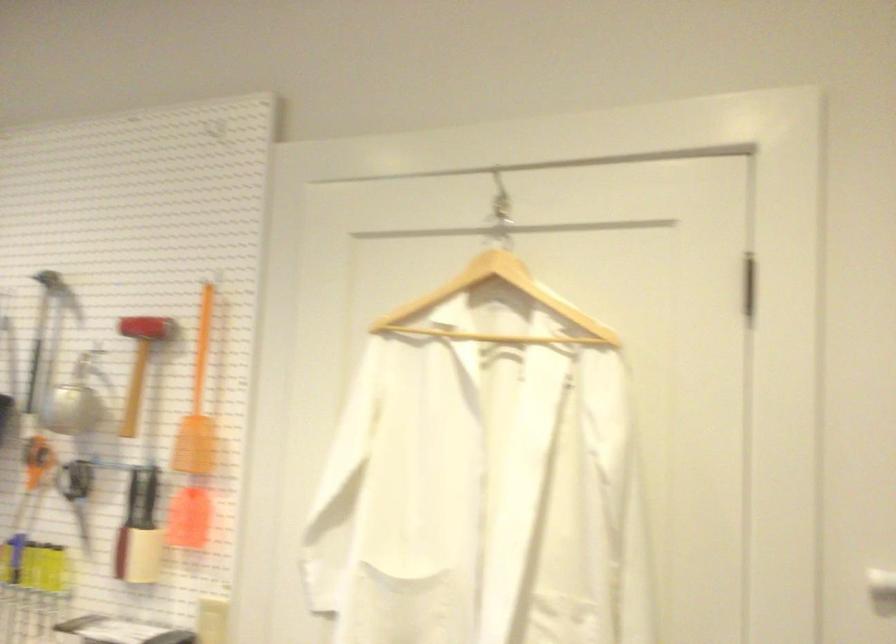
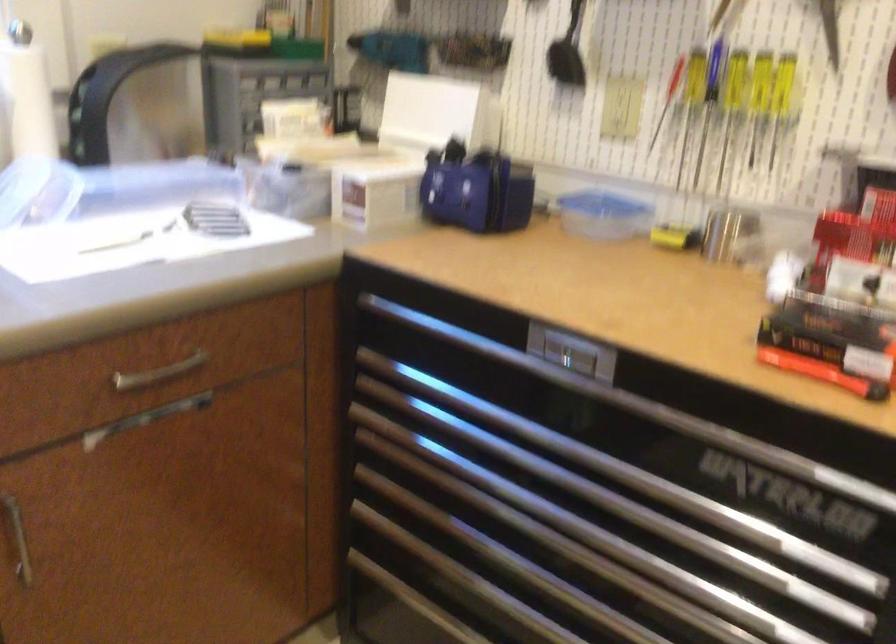
First-person continuous shooting, in which direction is the camera rotating?

The camera's rotation is toward left-down.